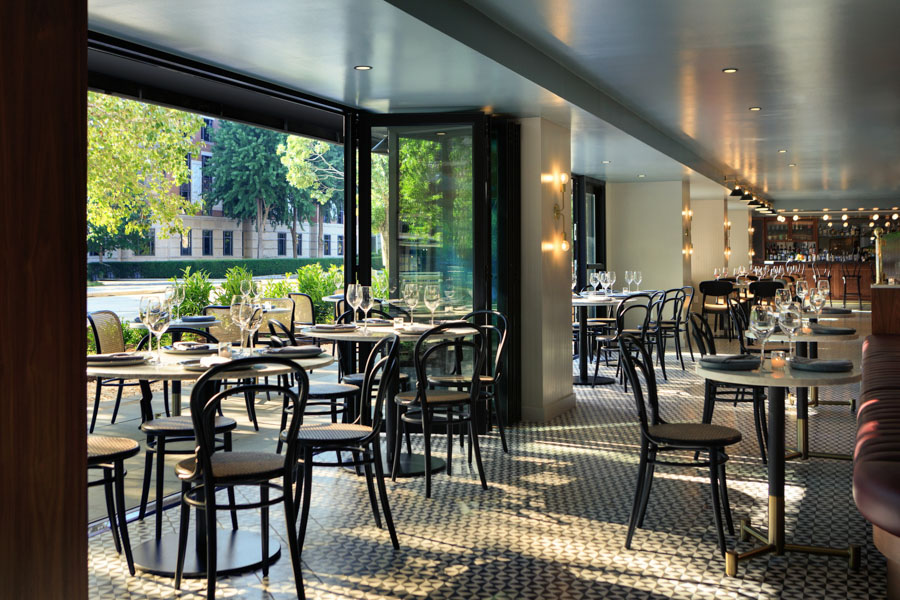
The height and width of the screenshot is (600, 900). I want to click on booth seat, so click(x=883, y=358), click(x=874, y=423).